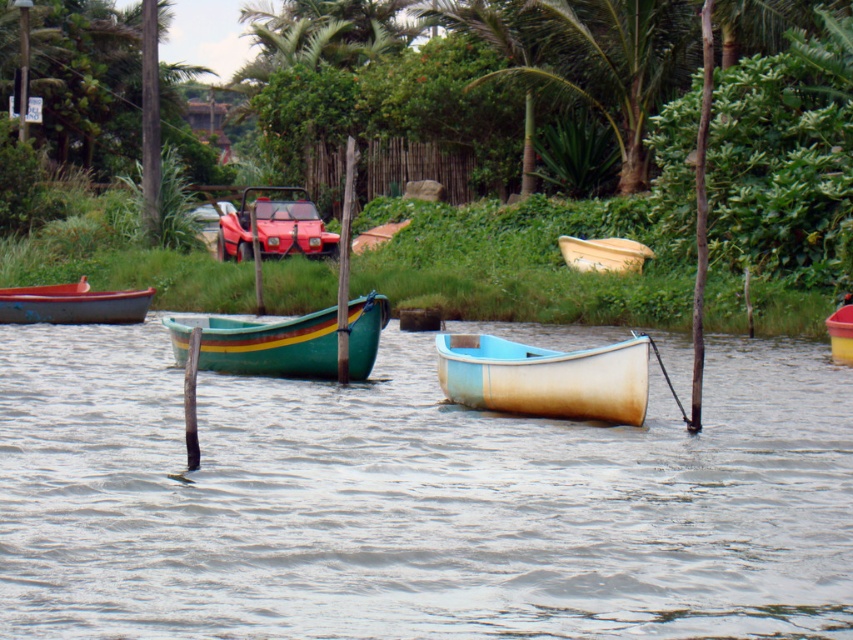
You are standing on the grassy bank near the red amphibious vehicle and want to reach the wooden canoe at center. Which direction should you head to avoid the clear water at center?

You should head to the left of the wooden canoe at center to avoid the clear water at center, since the clear water at center is to the right of the wooden canoe at center.

You are standing on the grassy bank near the red amphibious vehicle and want to take a photo of both the shiny red car at center and the wooden canoe at center. Which object should you focus on first to ensure it appears sharp in the photo?

You should focus on the shiny red car at center first because it is closer to you than the wooden canoe at center, so focusing on it will keep it sharp while the canoe may appear slightly blurred. Alternatively, you can adjust your focus point between them or use a smaller aperture for greater depth of field.